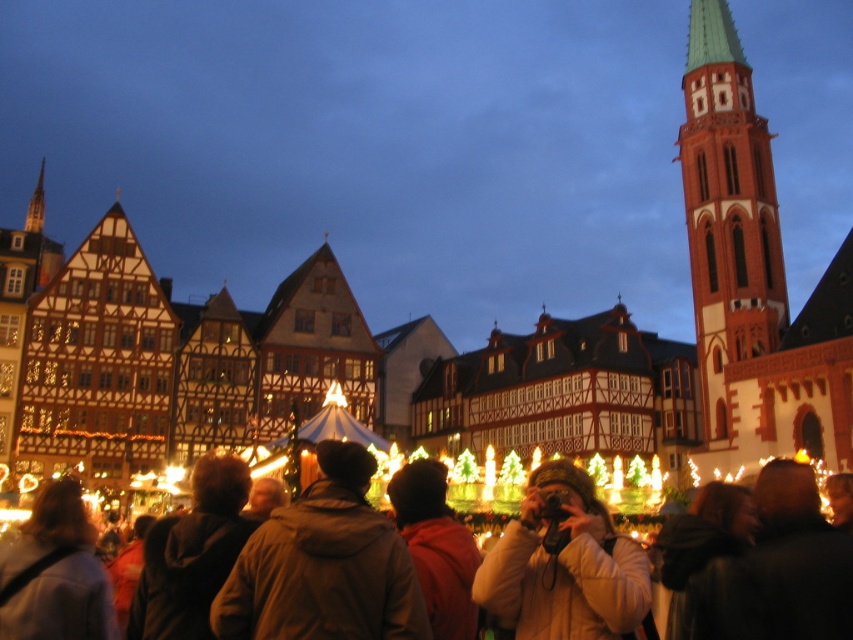
Who is lower down, red brick tower at upper right or brown fuzzy jacket at center?

brown fuzzy jacket at center

Does red brick tower at upper right have a smaller size compared to brown fuzzy jacket at center?

Incorrect, red brick tower at upper right is not smaller in size than brown fuzzy jacket at center.

Who is more forward, (x=762, y=276) or (x=370, y=532)?

Positioned in front is point (x=370, y=532).

I want to click on red brick tower at upper right, so click(729, 237).

Is brown fuzzy jacket at center positioned before brown fuzzy jacket at lower center?

Yes.

Who is taller, brown fuzzy jacket at center or brown fuzzy jacket at lower center?

brown fuzzy jacket at lower center is taller.

Locate an element on the screen. The width and height of the screenshot is (853, 640). brown fuzzy jacket at center is located at coordinates (323, 564).

Locate an element on the screen. Image resolution: width=853 pixels, height=640 pixels. brown fuzzy jacket at center is located at coordinates (323, 564).

Can you confirm if brown fuzzy jacket at lower center is wider than brown leather jacket at lower left?

No, brown fuzzy jacket at lower center is not wider than brown leather jacket at lower left.

Can you confirm if brown fuzzy jacket at lower center is positioned below brown leather jacket at lower left?

No, brown fuzzy jacket at lower center is not below brown leather jacket at lower left.

Does point (190, 636) come in front of point (61, 628)?

No, (190, 636) is further to viewer.

Identify the location of brown fuzzy jacket at lower center. Image resolution: width=853 pixels, height=640 pixels. (192, 554).